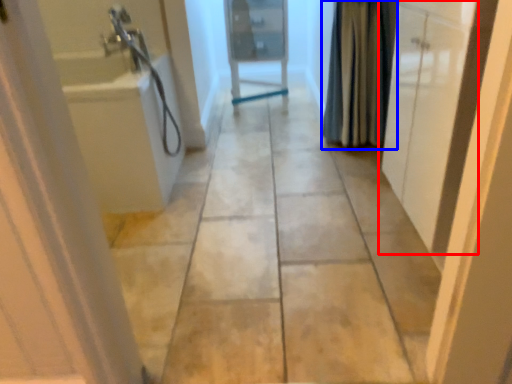
Question: Among these objects, which one is farthest to the camera, door (highlighted by a red box) or shower curtain (highlighted by a blue box)?

Choices:
 (A) door
 (B) shower curtain

Answer: (B)